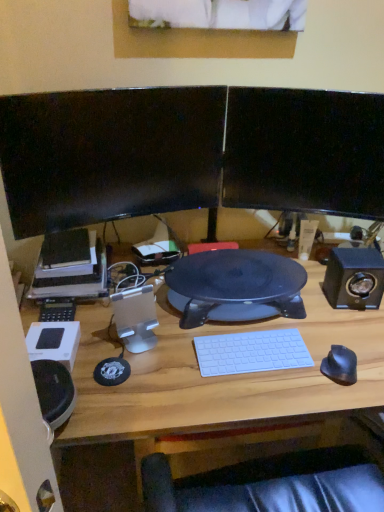
Question: Is black matte mouse at right positioned beyond the bounds of white plastic keyboard at center?

Choices:
 (A) yes
 (B) no

Answer: (A)

Question: Is black matte mouse at right not close to white plastic keyboard at center?

Choices:
 (A) no
 (B) yes

Answer: (A)

Question: Is the position of black matte mouse at right less distant than that of white plastic keyboard at center?

Choices:
 (A) yes
 (B) no

Answer: (A)

Question: Is the depth of black matte mouse at right greater than that of white plastic keyboard at center?

Choices:
 (A) yes
 (B) no

Answer: (B)

Question: Is black matte mouse at right thinner than white plastic keyboard at center?

Choices:
 (A) yes
 (B) no

Answer: (A)

Question: From the image's perspective, relative to black matte mouse at right, is black glossy monitor at upper right, the 1th computer monitor positioned from the right, above or below?

Choices:
 (A) above
 (B) below

Answer: (A)

Question: Considering the positions of point (307, 156) and point (350, 362), is point (307, 156) closer or farther from the camera than point (350, 362)?

Choices:
 (A) closer
 (B) farther

Answer: (B)

Question: Based on their positions, is black glossy monitor at upper right, the 1th computer monitor positioned from the right, located to the left or right of black matte mouse at right?

Choices:
 (A) right
 (B) left

Answer: (B)

Question: Relative to black matte mouse at right, is black glossy monitor at upper right, the 1th computer monitor positioned from the right, in front or behind?

Choices:
 (A) front
 (B) behind

Answer: (B)

Question: In the image, is black glossy monitor at upper left, the 1th computer monitor in the left-to-right sequence, on the left side or the right side of black matte mouse at right?

Choices:
 (A) right
 (B) left

Answer: (B)

Question: Is black glossy monitor at upper left, positioned as the second computer monitor in right-to-left order, situated inside black matte mouse at right or outside?

Choices:
 (A) outside
 (B) inside

Answer: (A)

Question: From the image's perspective, is black glossy monitor at upper left, positioned as the second computer monitor in right-to-left order, located above or below black matte mouse at right?

Choices:
 (A) below
 (B) above

Answer: (B)

Question: In terms of height, does black glossy monitor at upper left, the 1th computer monitor in the left-to-right sequence, look taller or shorter compared to black matte mouse at right?

Choices:
 (A) tall
 (B) short

Answer: (A)

Question: Choose the correct answer: Is black plastic desk at center inside matte black printer at left or outside it?

Choices:
 (A) outside
 (B) inside

Answer: (A)

Question: Based on their positions, is black plastic desk at center located to the left or right of matte black printer at left?

Choices:
 (A) right
 (B) left

Answer: (A)